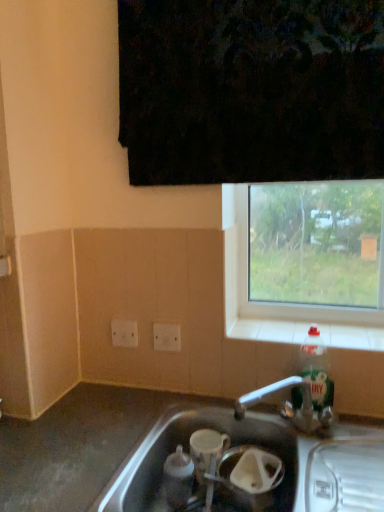
Describe the element at coordinates (124, 333) in the screenshot. This screenshot has height=512, width=384. I see `white plastic electric outlet at lower left, which is the 1th electric outlet in back-to-front order` at that location.

Locate an element on the screen. This screenshot has width=384, height=512. white plastic electric outlet at center, the 1th electric outlet when ordered from right to left is located at coordinates (167, 337).

Measure the distance between white tile at lower right and camera.

3.74 feet.

The height and width of the screenshot is (512, 384). What do you see at coordinates (277, 303) in the screenshot?
I see `clear glass window at upper right` at bounding box center [277, 303].

Where is `translucent plastic bottle at right`? The width and height of the screenshot is (384, 512). translucent plastic bottle at right is located at coordinates [316, 370].

Looking at this image, is white tile at lower right next to white plastic electric outlet at center, positioned as the second electric outlet in left-to-right order?

No.

Is white tile at lower right positioned beyond the bounds of white plastic electric outlet at center, the 1th electric outlet when ordered from right to left?

white tile at lower right is positioned outside white plastic electric outlet at center, the 1th electric outlet when ordered from right to left.

Would you say white tile at lower right is to the left or to the right of white plastic electric outlet at center, which appears as the first electric outlet when viewed from the front, in the picture?

Clearly, white tile at lower right is on the right of white plastic electric outlet at center, which appears as the first electric outlet when viewed from the front, in the image.

Can you tell me how much clear glass window at upper right and silver metallic sink at lower center differ in facing direction?

The angle between the facing direction of clear glass window at upper right and the facing direction of silver metallic sink at lower center is 0.0234 degrees.

Does clear glass window at upper right have a lesser height compared to silver metallic sink at lower center?

Yes.

Is clear glass window at upper right oriented towards silver metallic sink at lower center?

No, clear glass window at upper right is not facing towards silver metallic sink at lower center.

Which object is more forward, clear glass window at upper right or silver metallic sink at lower center?

silver metallic sink at lower center is more forward.

Is point (381, 329) less distant than point (121, 336)?

Yes, point (381, 329) is closer to viewer.

Is white tile at lower right at the left side of white plastic electric outlet at lower left, the second electric outlet in the right-to-left sequence?

In fact, white tile at lower right is to the right of white plastic electric outlet at lower left, the second electric outlet in the right-to-left sequence.

Considering the sizes of objects white tile at lower right and white plastic electric outlet at lower left, the 2th electric outlet when ordered from front to back, in the image provided, who is taller, white tile at lower right or white plastic electric outlet at lower left, the 2th electric outlet when ordered from front to back,?

white plastic electric outlet at lower left, the 2th electric outlet when ordered from front to back.

Is the surface of white tile at lower right in direct contact with white plastic electric outlet at lower left, the 2th electric outlet when ordered from front to back?

white tile at lower right and white plastic electric outlet at lower left, the 2th electric outlet when ordered from front to back, are clearly separated.

Is white plastic electric outlet at center, positioned as the second electric outlet in left-to-right order, next to translucent plastic bottle at right and touching it?

No, white plastic electric outlet at center, positioned as the second electric outlet in left-to-right order, is not in contact with translucent plastic bottle at right.

Is white plastic electric outlet at center, which appears as the first electric outlet when viewed from the front, oriented towards translucent plastic bottle at right?

Answer: No, white plastic electric outlet at center, which appears as the first electric outlet when viewed from the front, does not turn towards translucent plastic bottle at right.

From a real-world perspective, relative to translucent plastic bottle at right, is white plastic electric outlet at center, the 1th electric outlet when ordered from right to left, vertically above or below?

From a real-world perspective, white plastic electric outlet at center, the 1th electric outlet when ordered from right to left, is physically above translucent plastic bottle at right.

Consider the image. Does translucent plastic bottle at right turn towards white plastic electric outlet at center, the 2th electric outlet when ordered from back to front?

No, translucent plastic bottle at right is not facing towards white plastic electric outlet at center, the 2th electric outlet when ordered from back to front.

Visually, is translucent plastic bottle at right positioned to the left or to the right of white plastic electric outlet at center, the 1th electric outlet when ordered from right to left?

Based on their positions, translucent plastic bottle at right is located to the right of white plastic electric outlet at center, the 1th electric outlet when ordered from right to left.

How much distance is there between translucent plastic bottle at right and white plastic electric outlet at center, which appears as the first electric outlet when viewed from the front?

translucent plastic bottle at right and white plastic electric outlet at center, which appears as the first electric outlet when viewed from the front, are 15.45 inches apart from each other.

Considering the sizes of objects translucent plastic bottle at right and white plastic electric outlet at center, which appears as the first electric outlet when viewed from the front, in the image provided, who is shorter, translucent plastic bottle at right or white plastic electric outlet at center, which appears as the first electric outlet when viewed from the front,?

white plastic electric outlet at center, which appears as the first electric outlet when viewed from the front.

From the picture: Are clear glass window at upper right and white plastic electric outlet at center, positioned as the second electric outlet in left-to-right order, far apart?

No, clear glass window at upper right is not far from white plastic electric outlet at center, positioned as the second electric outlet in left-to-right order.

Looking at this image, from the image's perspective, which one is positioned higher, clear glass window at upper right or white plastic electric outlet at center, which appears as the first electric outlet when viewed from the front?

clear glass window at upper right, from the image's perspective.

Between clear glass window at upper right and white plastic electric outlet at center, which appears as the first electric outlet when viewed from the front, which one has more height?

clear glass window at upper right is taller.

Does clear glass window at upper right turn towards white plastic electric outlet at center, the 1th electric outlet when ordered from right to left?

No, clear glass window at upper right does not turn towards white plastic electric outlet at center, the 1th electric outlet when ordered from right to left.

Would you say silver metallic sink at lower center contains white plastic electric outlet at lower left, the second electric outlet in the right-to-left sequence?

That's incorrect, white plastic electric outlet at lower left, the second electric outlet in the right-to-left sequence, is not inside silver metallic sink at lower center.

Is silver metallic sink at lower center thinner than white plastic electric outlet at lower left, the 2th electric outlet when ordered from front to back?

Incorrect, the width of silver metallic sink at lower center is not less than that of white plastic electric outlet at lower left, the 2th electric outlet when ordered from front to back.

Considering the relative sizes of silver metallic sink at lower center and white plastic electric outlet at lower left, the second electric outlet in the right-to-left sequence, in the image provided, is silver metallic sink at lower center smaller than white plastic electric outlet at lower left, the second electric outlet in the right-to-left sequence,?

Incorrect, silver metallic sink at lower center is not smaller in size than white plastic electric outlet at lower left, the second electric outlet in the right-to-left sequence.

Is silver metallic sink at lower center oriented away from white plastic electric outlet at lower left, the 2th electric outlet when ordered from front to back?

silver metallic sink at lower center does not have its back to white plastic electric outlet at lower left, the 2th electric outlet when ordered from front to back.

The image size is (384, 512). What are the coordinates of `the 2nd electric outlet located beneath the white tile at lower right (from a real-world perspective)` in the screenshot? It's located at pyautogui.click(x=167, y=337).

Image resolution: width=384 pixels, height=512 pixels. I want to click on window located behind the silver metallic sink at lower center, so click(x=277, y=303).

Considering their positions, is white plastic electric outlet at lower left, the second electric outlet in the right-to-left sequence, positioned further to white tile at lower right than white plastic electric outlet at center, which appears as the first electric outlet when viewed from the front?

Based on the image, white plastic electric outlet at lower left, the second electric outlet in the right-to-left sequence, appears to be further to white tile at lower right.

In the scene shown: Looking at the image, which one is located closer to translucent plastic bottle at right, white plastic electric outlet at center, the 1th electric outlet when ordered from right to left, or white tile at lower right?

white tile at lower right is positioned closer to the anchor translucent plastic bottle at right.

Based on their spatial positions, is silver metallic sink at lower center or white tile at lower right closer to white plastic electric outlet at center, positioned as the second electric outlet in left-to-right order?

The object closer to white plastic electric outlet at center, positioned as the second electric outlet in left-to-right order, is white tile at lower right.

From the image, which object appears to be nearer to white plastic electric outlet at center, the 2th electric outlet when ordered from back to front, clear glass window at upper right or silver metallic sink at lower center?

Based on the image, clear glass window at upper right appears to be nearer to white plastic electric outlet at center, the 2th electric outlet when ordered from back to front.

Which object lies nearer to the anchor point white plastic electric outlet at center, the 1th electric outlet when ordered from right to left, translucent plastic bottle at right or white tile at lower right?

white tile at lower right is closer to white plastic electric outlet at center, the 1th electric outlet when ordered from right to left.

Based on their spatial positions, is translucent plastic bottle at right or clear glass window at upper right further from silver metallic sink at lower center?

clear glass window at upper right is positioned further to the anchor silver metallic sink at lower center.

Considering their positions, is silver metallic sink at lower center positioned closer to white plastic electric outlet at lower left, the second electric outlet in the right-to-left sequence, than white tile at lower right?

white tile at lower right is positioned closer to the anchor white plastic electric outlet at lower left, the second electric outlet in the right-to-left sequence.

Considering their positions, is white plastic electric outlet at lower left, which is counted as the 1th electric outlet, starting from the left, positioned closer to clear glass window at upper right than white tile at lower right?

white tile at lower right is closer to clear glass window at upper right.

This screenshot has width=384, height=512. I want to click on electric outlet between white plastic electric outlet at lower left, the 2th electric outlet when ordered from front to back, and translucent plastic bottle at right from left to right, so click(x=167, y=337).

In order to click on electric outlet situated between white plastic electric outlet at lower left, the second electric outlet in the right-to-left sequence, and white tile at lower right from left to right in this screenshot , I will do `click(167, 337)`.

Locate an element on the screen. This screenshot has width=384, height=512. window sill between silver metallic sink at lower center and white plastic electric outlet at center, positioned as the second electric outlet in left-to-right order, in the front-back direction is located at coordinates (267, 329).

The width and height of the screenshot is (384, 512). In order to click on window sill located between white plastic electric outlet at center, which appears as the first electric outlet when viewed from the front, and clear glass window at upper right in the left-right direction in this screenshot , I will do `click(267, 329)`.